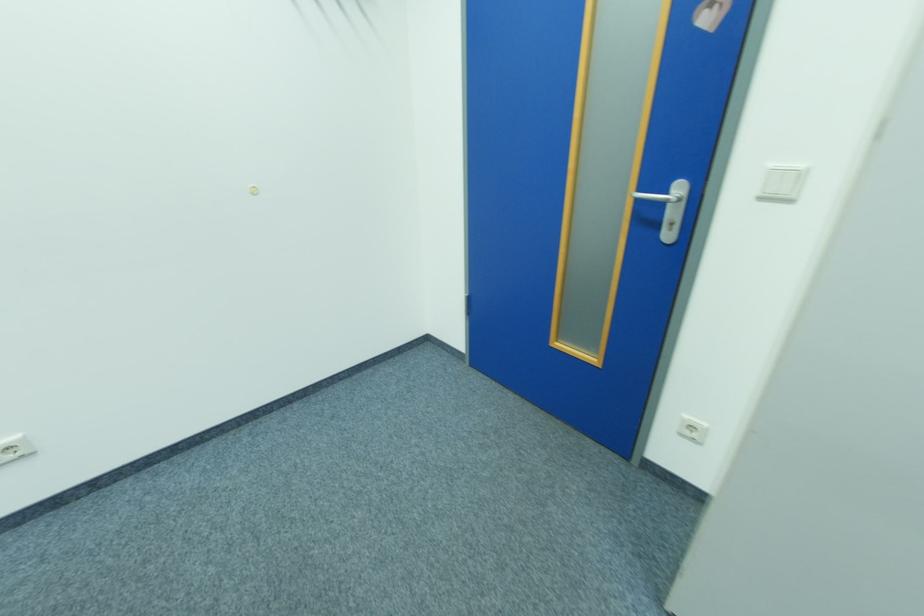
The height and width of the screenshot is (616, 924). What do you see at coordinates (669, 196) in the screenshot?
I see `the silver door handle` at bounding box center [669, 196].